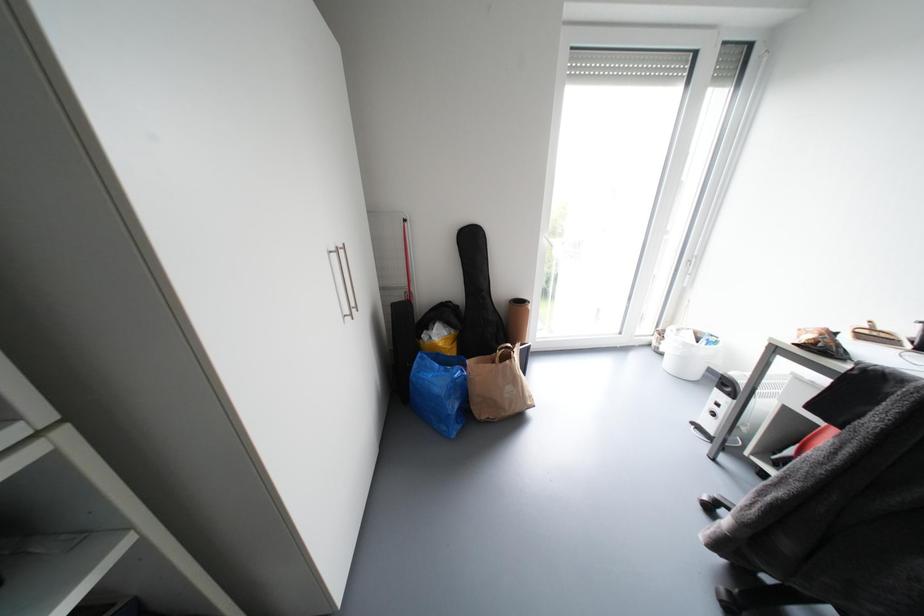
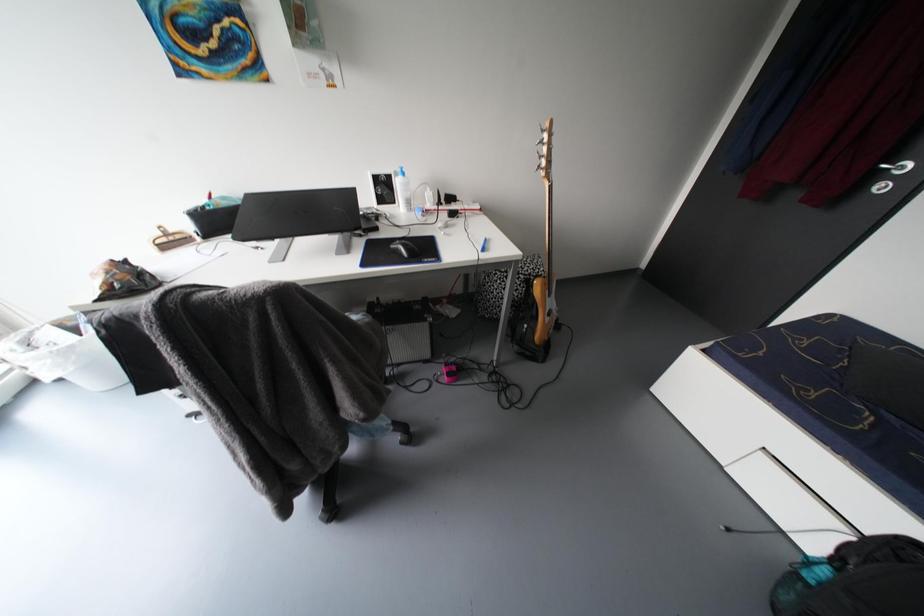
Based on the continuous images, in which direction is the camera rotating?

The camera rotated toward right-down.